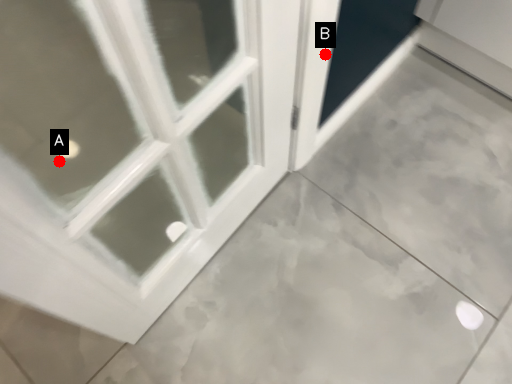
Question: Two points are circled on the image, labeled by A and B beside each circle. Which point appears farthest from the camera in this image?

Choices:
 (A) A is further
 (B) B is further

Answer: (B)